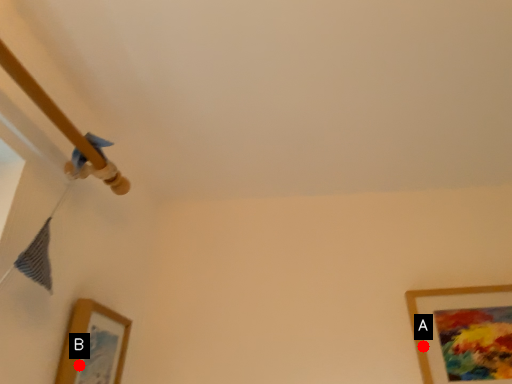
Question: Two points are circled on the image, labeled by A and B beside each circle. Which of the following is the farthest from the observer?

Choices:
 (A) A is further
 (B) B is further

Answer: (A)